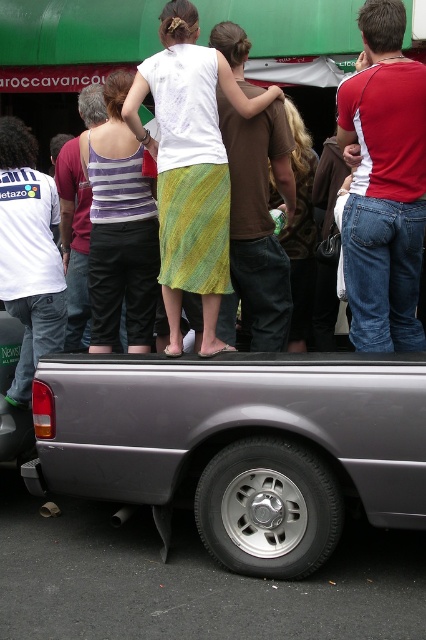
Is metallic gray truck at lower center taller than matte black truck at center?

In fact, metallic gray truck at lower center may be shorter than matte black truck at center.

Who is shorter, metallic gray truck at lower center or matte black truck at center?

metallic gray truck at lower center is shorter.

Is point (216, 513) positioned in front of point (402, 131)?

No, it is behind (402, 131).

The image size is (426, 640). Find the location of `metallic gray truck at lower center`. metallic gray truck at lower center is located at coordinates (239, 445).

Between matte black truck at center and white jersey at left, which one appears on the right side from the viewer's perspective?

Positioned to the right is matte black truck at center.

Who is lower down, matte black truck at center or white jersey at left?

white jersey at left is lower down.

I want to click on matte black truck at center, so click(383, 184).

Where is `matte black truck at center`? matte black truck at center is located at coordinates (383, 184).

Who is more forward, (288, 548) or (112, 266)?

Positioned in front is point (288, 548).

What are the coordinates of `metallic gray truck at lower center` in the screenshot? It's located at (239, 445).